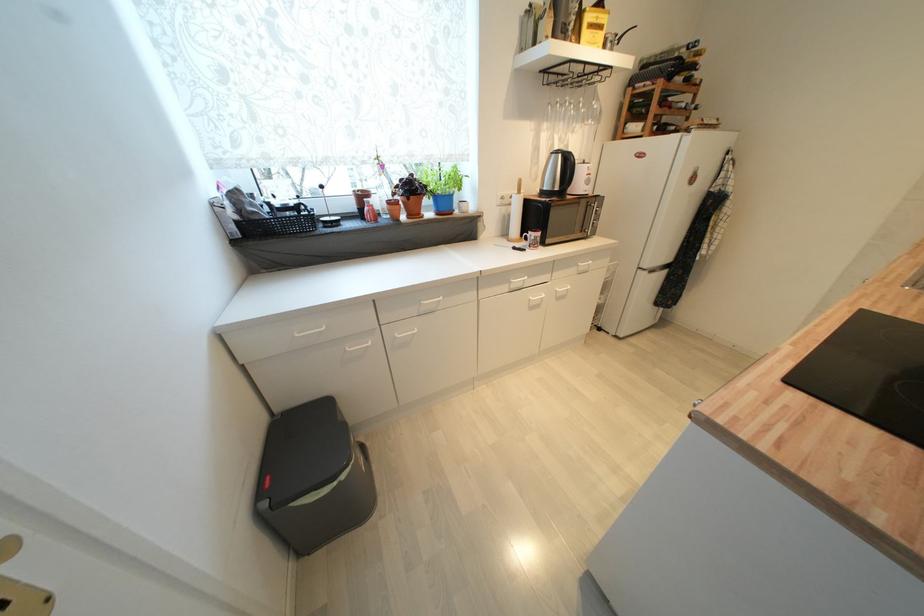
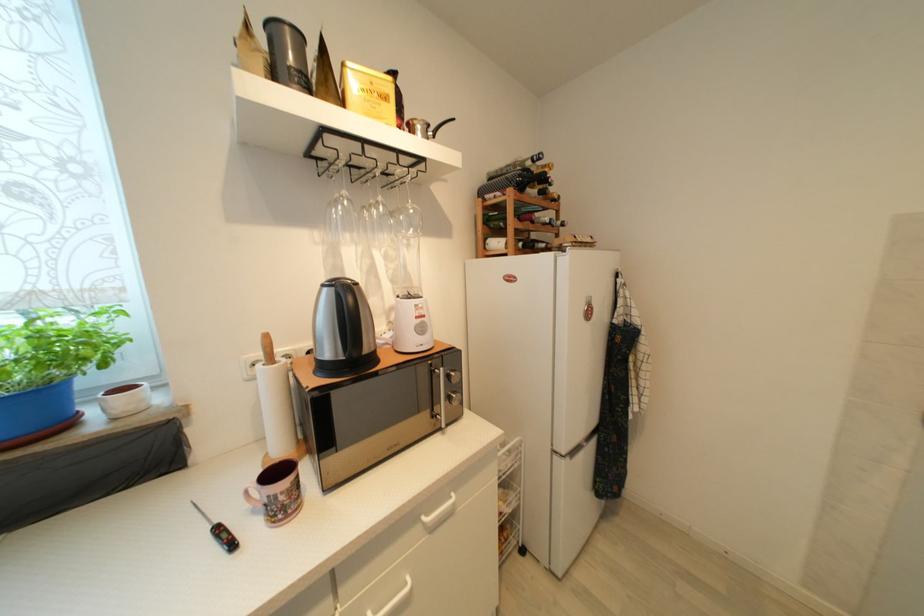
The point at [463,184] is marked in the first image. Where is the corresponding point in the second image?

(77, 353)